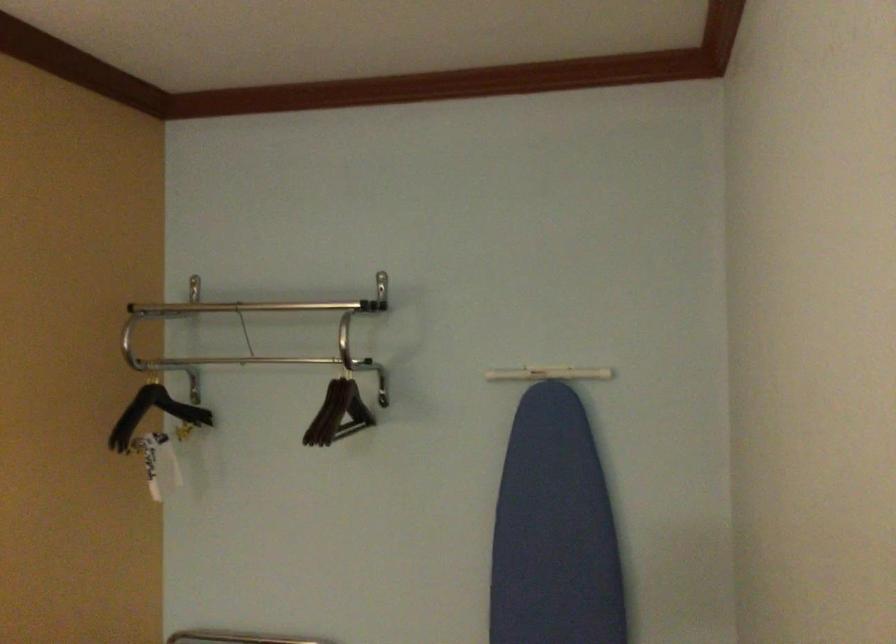
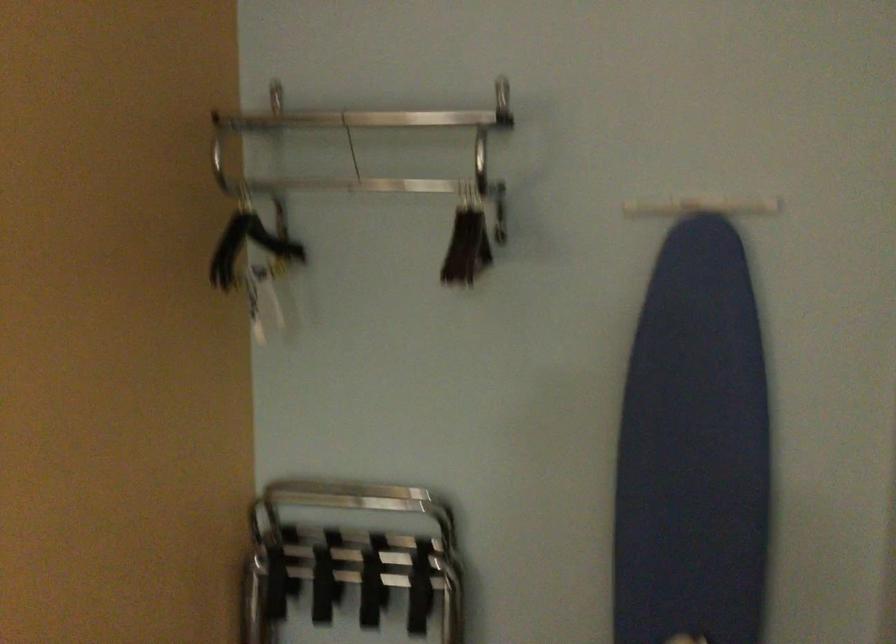
Locate, in the second image, the point that corresponds to point (280, 325) in the first image.

(381, 147)